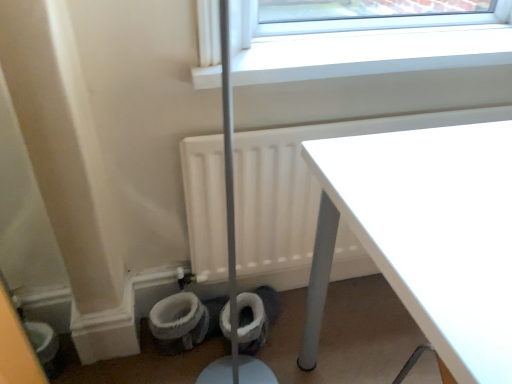
Where is `white fabric toilet bowl at lower left`? This screenshot has height=384, width=512. white fabric toilet bowl at lower left is located at coordinates (178, 322).

I want to click on white plastic window sill at upper center, so click(370, 53).

Which is more to the right, white plastic window sill at upper center or white glossy table at upper right?

white glossy table at upper right is more to the right.

Does point (389, 57) come closer to viewer compared to point (401, 166)?

No, it is not.

Find the location of a particular element. This screenshot has width=512, height=384. table below the white plastic window sill at upper center (from a real-world perspective) is located at coordinates (426, 235).

Does white plastic window sill at upper center have a greater height compared to white glossy table at upper right?

Incorrect, the height of white plastic window sill at upper center is not larger of that of white glossy table at upper right.

From a real-world perspective, is white matte radiator at lower left positioned under white fabric toilet bowl at lower left based on gravity?

No.

How different are the orientations of white matte radiator at lower left and white fabric toilet bowl at lower left in degrees?

0.836 degrees.

Is white matte radiator at lower left facing towards white fabric toilet bowl at lower left?

No, white matte radiator at lower left is not turned towards white fabric toilet bowl at lower left.

From their relative heights in the image, would you say white matte radiator at lower left is taller or shorter than white fabric toilet bowl at lower left?

Considering their sizes, white matte radiator at lower left has more height than white fabric toilet bowl at lower left.

Between white glossy table at upper right and white fluffy toilet paper at lower center, which one has more height?

Standing taller between the two is white glossy table at upper right.

At what (x,y) coordinates should I click in order to perform the action: click on toilet paper below the white glossy table at upper right (from a real-world perspective). Please return your answer as a coordinate pair (x, y). Looking at the image, I should click on 253,316.

From the picture: Is white glossy table at upper right positioned in front of white fluffy toilet paper at lower center?

Yes, it is.

Could you measure the distance between white fabric toilet bowl at lower left and white fluffy toilet paper at lower center?

14.00 centimeters.

Could you tell me if white fabric toilet bowl at lower left is facing white fluffy toilet paper at lower center?

No, white fabric toilet bowl at lower left does not turn towards white fluffy toilet paper at lower center.

Is point (190, 321) positioned after point (253, 303)?

No.

Can you confirm if white fabric toilet bowl at lower left is bigger than white fluffy toilet paper at lower center?

Yes, white fabric toilet bowl at lower left is bigger than white fluffy toilet paper at lower center.

Is white fabric toilet bowl at lower left inside or outside of white glossy table at upper right?

white fabric toilet bowl at lower left is outside white glossy table at upper right.

From a real-world perspective, which object rests below the other?

From a 3D spatial view, white fabric toilet bowl at lower left is below.

Which is behind, point (198, 327) or point (393, 212)?

Positioned behind is point (198, 327).

How many degrees apart are the facing directions of white fabric toilet bowl at lower left and white glossy table at upper right?

The angle between the facing direction of white fabric toilet bowl at lower left and the facing direction of white glossy table at upper right is 91 degrees.

Is white matte radiator at lower left turned away from white glossy table at upper right?

white matte radiator at lower left is not turned away from white glossy table at upper right.

Between white matte radiator at lower left and white glossy table at upper right, which one has larger width?

white matte radiator at lower left.

In the image, is white matte radiator at lower left positioned in front of or behind white glossy table at upper right?

Clearly, white matte radiator at lower left is behind white glossy table at upper right.

Considering the positions of objects white matte radiator at lower left and white glossy table at upper right in the image provided, who is more to the right, white matte radiator at lower left or white glossy table at upper right?

white glossy table at upper right.

Does white glossy table at upper right lie behind white fabric toilet bowl at lower left?

No.

From a real-world perspective, which object stands above the other?

In real-world perspective, white glossy table at upper right is above.

How far apart are white glossy table at upper right and white fabric toilet bowl at lower left?

They are 25.46 inches apart.

Does white glossy table at upper right contain white fabric toilet bowl at lower left?

No, white fabric toilet bowl at lower left is not surrounded by white glossy table at upper right.

Where is `table on the right of white plastic window sill at upper center`? The image size is (512, 384). table on the right of white plastic window sill at upper center is located at coordinates (426, 235).

The width and height of the screenshot is (512, 384). In order to click on radiator above the white fabric toilet bowl at lower left (from a real-world perspective) in this screenshot , I will do `click(302, 184)`.

Consider the image. Considering their positions, is white fluffy toilet paper at lower center positioned closer to white matte radiator at lower left than white plastic window sill at upper center?

white plastic window sill at upper center lies closer to white matte radiator at lower left than the other object.

From the image, which object appears to be farther from white plastic window sill at upper center, white fluffy toilet paper at lower center or white fabric toilet bowl at lower left?

Based on the image, white fabric toilet bowl at lower left appears to be further to white plastic window sill at upper center.

Which object lies nearer to the anchor point white fluffy toilet paper at lower center, white plastic window sill at upper center or white fabric toilet bowl at lower left?

Result: The object closer to white fluffy toilet paper at lower center is white fabric toilet bowl at lower left.

When comparing their distances from white matte radiator at lower left, does white glossy table at upper right or white fluffy toilet paper at lower center seem further?

The object further to white matte radiator at lower left is white fluffy toilet paper at lower center.

When comparing their distances from white fabric toilet bowl at lower left, does white plastic window sill at upper center or white glossy table at upper right seem closer?

The object closer to white fabric toilet bowl at lower left is white glossy table at upper right.

From the image, which object appears to be farther from white plastic window sill at upper center, white glossy table at upper right or white fluffy toilet paper at lower center?

The object further to white plastic window sill at upper center is white fluffy toilet paper at lower center.

Based on their spatial positions, is white plastic window sill at upper center or white fabric toilet bowl at lower left closer to white glossy table at upper right?

white plastic window sill at upper center lies closer to white glossy table at upper right than the other object.

From the image, which object appears to be nearer to white fabric toilet bowl at lower left, white glossy table at upper right or white matte radiator at lower left?

white matte radiator at lower left lies closer to white fabric toilet bowl at lower left than the other object.

I want to click on toilet paper between white fabric toilet bowl at lower left and white matte radiator at lower left from left to right, so click(253, 316).

Image resolution: width=512 pixels, height=384 pixels. What are the coordinates of `table between white plastic window sill at upper center and white fabric toilet bowl at lower left in the vertical direction` in the screenshot? It's located at (426, 235).

I want to click on radiator between white plastic window sill at upper center and white fluffy toilet paper at lower center in the up-down direction, so click(x=302, y=184).

Where is `radiator located between white glossy table at upper right and white fluffy toilet paper at lower center in the depth direction`? This screenshot has height=384, width=512. radiator located between white glossy table at upper right and white fluffy toilet paper at lower center in the depth direction is located at coordinates (302, 184).